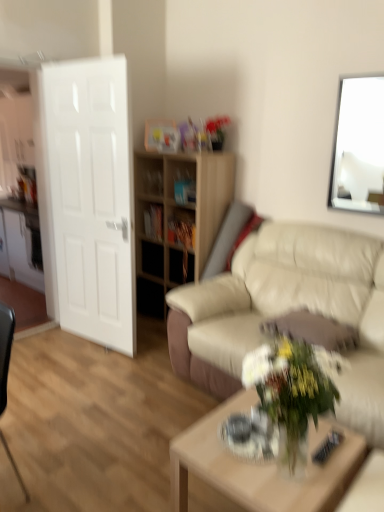
Question: From the image's perspective, is white glossy door at left located above or below white glossy picture frame at upper right?

Choices:
 (A) below
 (B) above

Answer: (A)

Question: From their relative heights in the image, would you say white glossy door at left is taller or shorter than white glossy picture frame at upper right?

Choices:
 (A) short
 (B) tall

Answer: (B)

Question: Which object is positioned closest to the black matte drawer at center?

Choices:
 (A) white glossy vase at lower center
 (B) light wood/texture coffee table at center
 (C) white glossy door at left
 (D) light wood shelf at center
 (E) beige leather couch at center

Answer: (D)

Question: Estimate the real-world distances between objects in this image. Which object is closer to the beige leather couch at center?

Choices:
 (A) white glossy door at left
 (B) white glossy vase at lower center
 (C) light wood/texture coffee table at center
 (D) light wood shelf at center
 (E) white glossy door at left

Answer: (C)